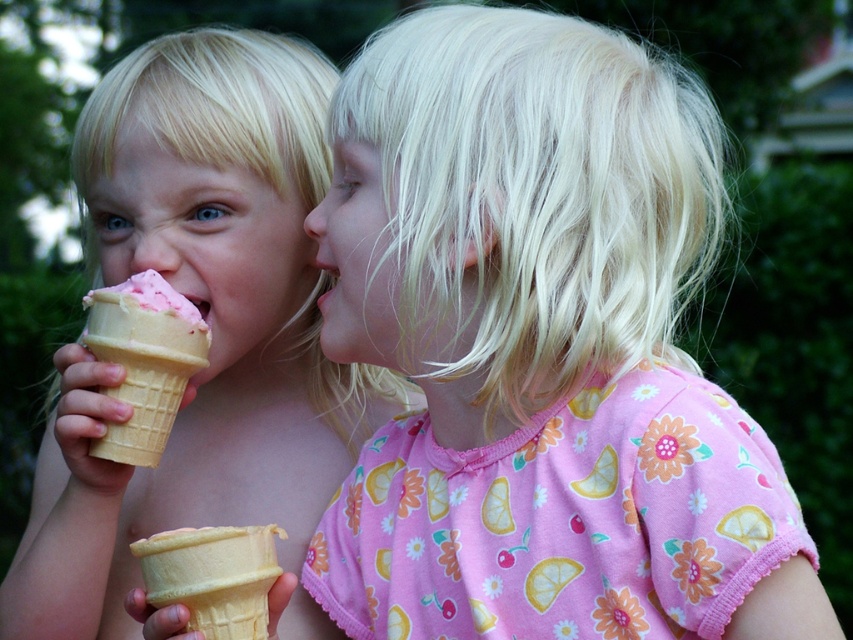
You are a photographer taking a picture of the two children. You want to ensure that the blonde hair at center and the pink soft serve ice cream at left are both clearly visible. Which object should you focus on to ensure the taller one is in focus?

The blonde hair at center should be focused on because it has a greater height compared to the pink soft serve ice cream at left, so focusing on the taller object will ensure both are in focus.

You are a photographer taking a picture of two children. The scene includes a blonde hair at center and a pink soft serve ice cream at left. Based on their sizes, which one should you focus on to ensure the subject is prominent?

The blonde hair at center has a larger size compared to the pink soft serve ice cream at left, so you should focus on the blonde hair at center to make it the prominent subject.

You are a photographer trying to capture a closeup of the vanilla waffle cone at lower left without including the blonde hair at center in the frame. Given their relative sizes, is this possible?

The blonde hair at center is wider than the vanilla waffle cone at lower left, so it might be challenging to frame the cone without including the hair unless you adjust the camera angle or zoom in closely.